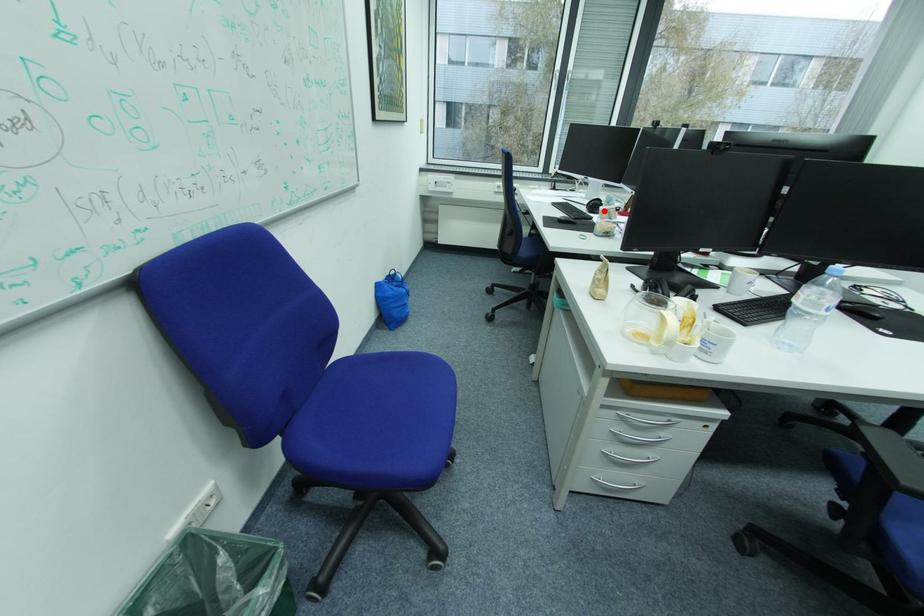
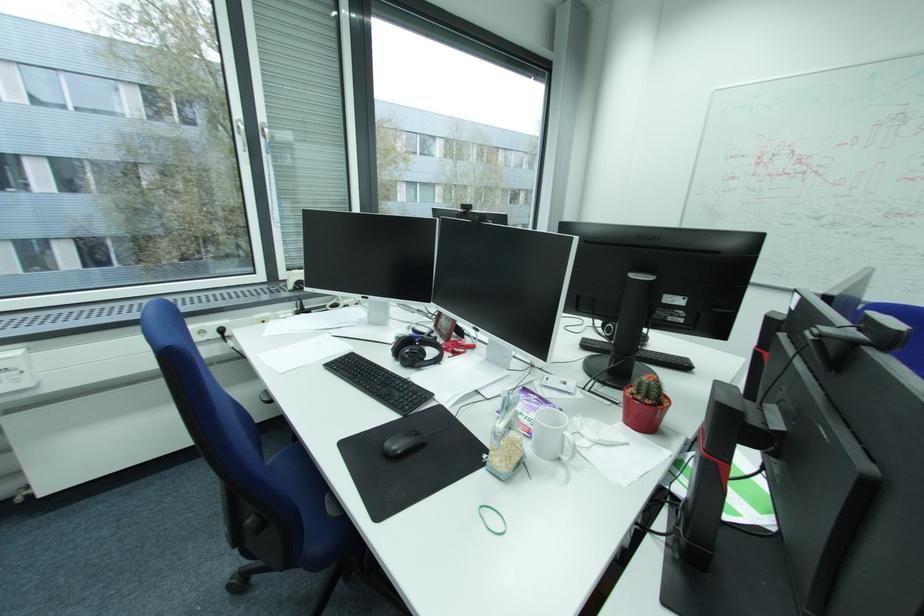
In the second image, find the point that corresponds to the highlighted location in the first image.

(427, 365)